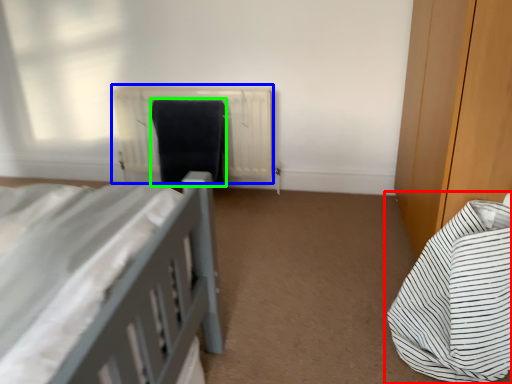
Question: Based on their relative distances, which object is nearer to bed (highlighted by a red box)? Choose from radiator (highlighted by a blue box) and laundry (highlighted by a green box).

Choices:
 (A) radiator
 (B) laundry

Answer: (A)